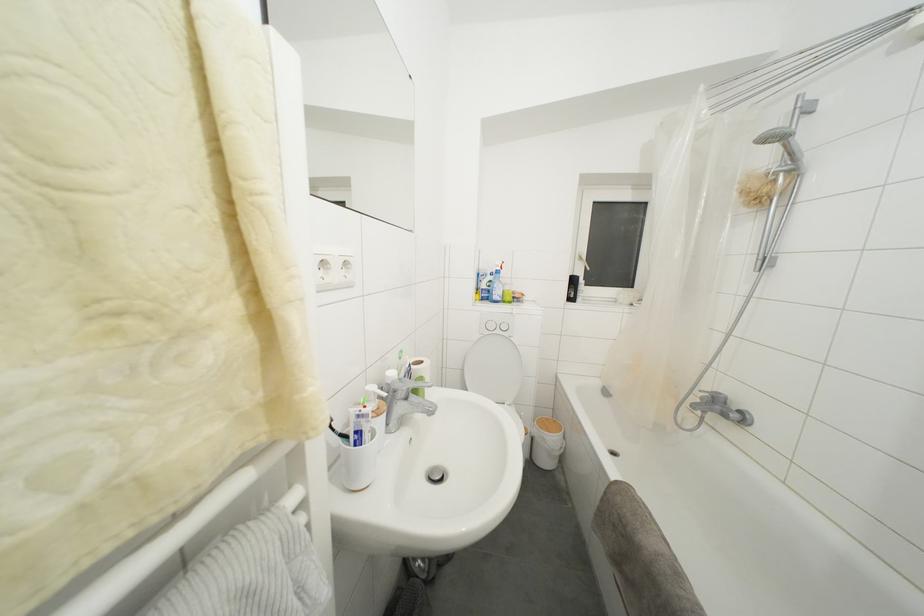
Locate an element on the screen. This screenshot has height=616, width=924. faucet handle is located at coordinates (412, 385).